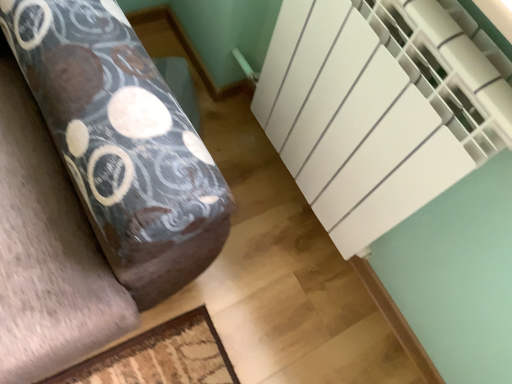
Describe the element at coordinates (407, 125) in the screenshot. I see `white matte radiator at right` at that location.

At what (x,y) coordinates should I click in order to perform the action: click on white matte radiator at right. Please return your answer as a coordinate pair (x, y). Looking at the image, I should click on (407, 125).

Measure the distance between white matte radiator at upper right and camera.

The depth of white matte radiator at upper right is 23.23 inches.

Where is `white matte radiator at upper right`? The image size is (512, 384). white matte radiator at upper right is located at coordinates (122, 144).

The width and height of the screenshot is (512, 384). What do you see at coordinates (122, 144) in the screenshot?
I see `white matte radiator at upper right` at bounding box center [122, 144].

In order to face white matte radiator at upper right, should I rotate leftwards or rightwards?

A 11.234 degree turn to the left will do.

I want to click on white matte radiator at right, so click(407, 125).

Considering the relative positions of white matte radiator at upper right and white matte radiator at right in the image provided, is white matte radiator at upper right to the left of white matte radiator at right from the viewer's perspective?

Yes, white matte radiator at upper right is to the left of white matte radiator at right.

Does white matte radiator at upper right come behind white matte radiator at right?

Yes, it is behind white matte radiator at right.

Does point (219, 171) come behind point (413, 185)?

No, it is in front of (413, 185).

From the image's perspective, between white matte radiator at upper right and white matte radiator at right, which one is located above?

From the image's view, white matte radiator at right is above.

From a real-world perspective, which is physically above, white matte radiator at upper right or white matte radiator at right?

white matte radiator at right is physically above.

Between white matte radiator at upper right and white matte radiator at right, which one has larger width?

With larger width is white matte radiator at upper right.

Can you confirm if white matte radiator at upper right is taller than white matte radiator at right?

No, white matte radiator at upper right is not taller than white matte radiator at right.

From the picture: Can you confirm if white matte radiator at upper right is bigger than white matte radiator at right?

No.

Is white matte radiator at right located within white matte radiator at upper right?

Definitely not — white matte radiator at right is not inside white matte radiator at upper right.

Is white matte radiator at upper right beside white matte radiator at right?

No.

Is white matte radiator at upper right turned away from white matte radiator at right?

That's not correct — white matte radiator at upper right is not looking away from white matte radiator at right.

How much distance is there between white matte radiator at upper right and white matte radiator at right?

A distance of 36.85 centimeters exists between white matte radiator at upper right and white matte radiator at right.

Find the location of a particular element. Image resolution: width=512 pixels, height=384 pixels. furniture located on the left of white matte radiator at right is located at coordinates (122, 144).

Based on the photo, which is more to the right, white matte radiator at right or white matte radiator at upper right?

From the viewer's perspective, white matte radiator at right appears more on the right side.

Is the position of white matte radiator at right less distant than that of white matte radiator at upper right?

Yes.

Is point (377, 40) farther from viewer compared to point (73, 6)?

No, it is not.

Consider the image. From the image's perspective, is white matte radiator at right positioned above or below white matte radiator at upper right?

From the image's perspective, white matte radiator at right appears above white matte radiator at upper right.

Looking at this image, from a real-world perspective, between white matte radiator at right and white matte radiator at upper right, who is vertically higher?

white matte radiator at right.

Between white matte radiator at right and white matte radiator at upper right, which one has larger width?

With larger width is white matte radiator at upper right.

Can you confirm if white matte radiator at right is taller than white matte radiator at upper right?

Yes, white matte radiator at right is taller than white matte radiator at upper right.

Which of these two, white matte radiator at right or white matte radiator at upper right, is bigger?

white matte radiator at right is bigger.

Would you say white matte radiator at right is outside white matte radiator at upper right?

white matte radiator at right is positioned outside white matte radiator at upper right.

Is white matte radiator at right touching white matte radiator at upper right?

No, white matte radiator at right is not next to white matte radiator at upper right.

Is white matte radiator at right oriented away from white matte radiator at upper right?

No, white matte radiator at upper right is not at the back of white matte radiator at right.

How many degrees apart are the facing directions of white matte radiator at right and white matte radiator at upper right?

There is a 89.8-degree angle between the facing directions of white matte radiator at right and white matte radiator at upper right.

At what (x,y) coordinates should I click in order to perform the action: click on furniture that appears below the white matte radiator at right (from a real-world perspective). Please return your answer as a coordinate pair (x, y). The height and width of the screenshot is (384, 512). Looking at the image, I should click on (122, 144).

Locate an element on the screen. stairwell above the white matte radiator at upper right (from a real-world perspective) is located at coordinates (407, 125).

In the image, there is a white matte radiator at upper right. Where is `stairwell above it (from the image's perspective)`? The image size is (512, 384). stairwell above it (from the image's perspective) is located at coordinates (407, 125).